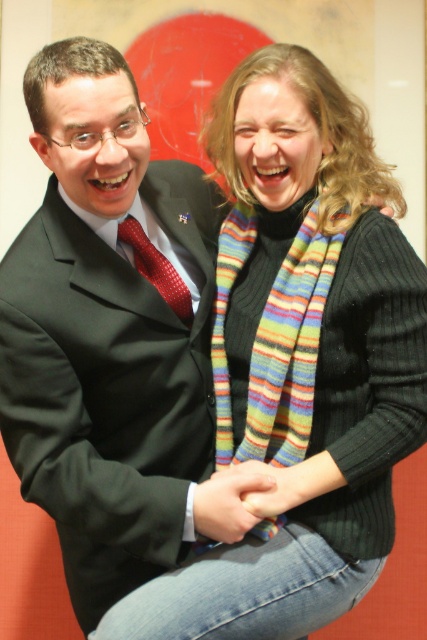
Is multicolored knitted scarf at center further to the viewer compared to red silk tie at center?

No, multicolored knitted scarf at center is closer to the viewer.

Does multicolored knitted scarf at center have a larger size compared to red silk tie at center?

Correct, multicolored knitted scarf at center is larger in size than red silk tie at center.

Find the location of `multicolored knitted scarf at center`. multicolored knitted scarf at center is located at coordinates (272, 340).